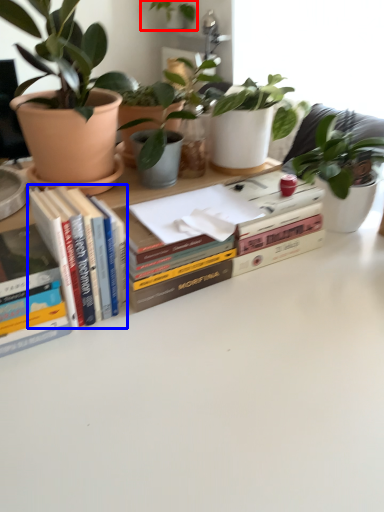
Question: Which object is further to the camera taking this photo, houseplant (highlighted by a red box) or book (highlighted by a blue box)?

Choices:
 (A) houseplant
 (B) book

Answer: (A)